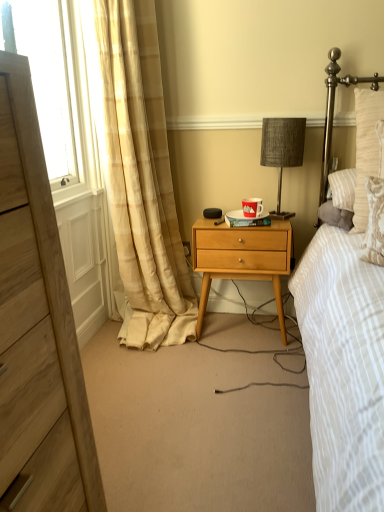
Question: From the image's perspective, is wooden chest of drawers at left over textured gray lampshade at center?

Choices:
 (A) yes
 (B) no

Answer: (B)

Question: From a real-world perspective, is wooden chest of drawers at left on top of textured gray lampshade at center?

Choices:
 (A) no
 (B) yes

Answer: (A)

Question: Is wooden chest of drawers at left closer to the viewer compared to textured gray lampshade at center?

Choices:
 (A) yes
 (B) no

Answer: (A)

Question: Can you confirm if wooden chest of drawers at left is shorter than textured gray lampshade at center?

Choices:
 (A) no
 (B) yes

Answer: (A)

Question: Is wooden chest of drawers at left outside of textured gray lampshade at center?

Choices:
 (A) no
 (B) yes

Answer: (B)

Question: Can you confirm if wooden chest of drawers at left is smaller than textured gray lampshade at center?

Choices:
 (A) no
 (B) yes

Answer: (A)

Question: Can you confirm if wooden chest of drawers at left is shorter than beige plaid curtain at left?

Choices:
 (A) yes
 (B) no

Answer: (A)

Question: Is wooden chest of drawers at left positioned far away from beige plaid curtain at left?

Choices:
 (A) no
 (B) yes

Answer: (B)

Question: Is wooden chest of drawers at left taller than beige plaid curtain at left?

Choices:
 (A) yes
 (B) no

Answer: (B)

Question: From a real-world perspective, does wooden chest of drawers at left stand above beige plaid curtain at left?

Choices:
 (A) yes
 (B) no

Answer: (A)

Question: Considering the relative sizes of wooden chest of drawers at left and beige plaid curtain at left in the image provided, is wooden chest of drawers at left bigger than beige plaid curtain at left?

Choices:
 (A) no
 (B) yes

Answer: (A)

Question: Does wooden chest of drawers at left have a smaller size compared to beige plaid curtain at left?

Choices:
 (A) no
 (B) yes

Answer: (B)

Question: Does wooden chest of drawers at left contain wooden nightstand at center?

Choices:
 (A) yes
 (B) no

Answer: (B)